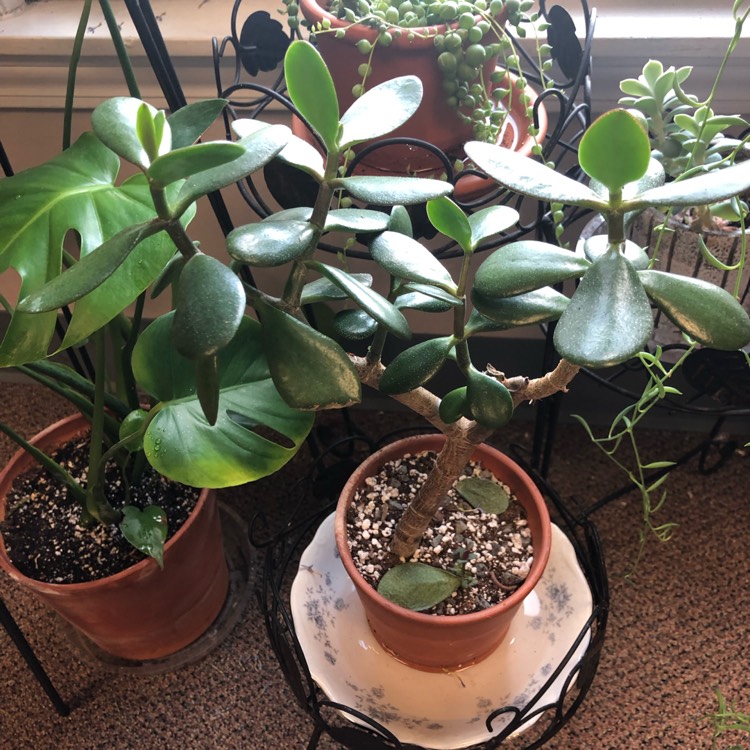
In order to click on white plant in this screenshot , I will do `click(468, 663)`.